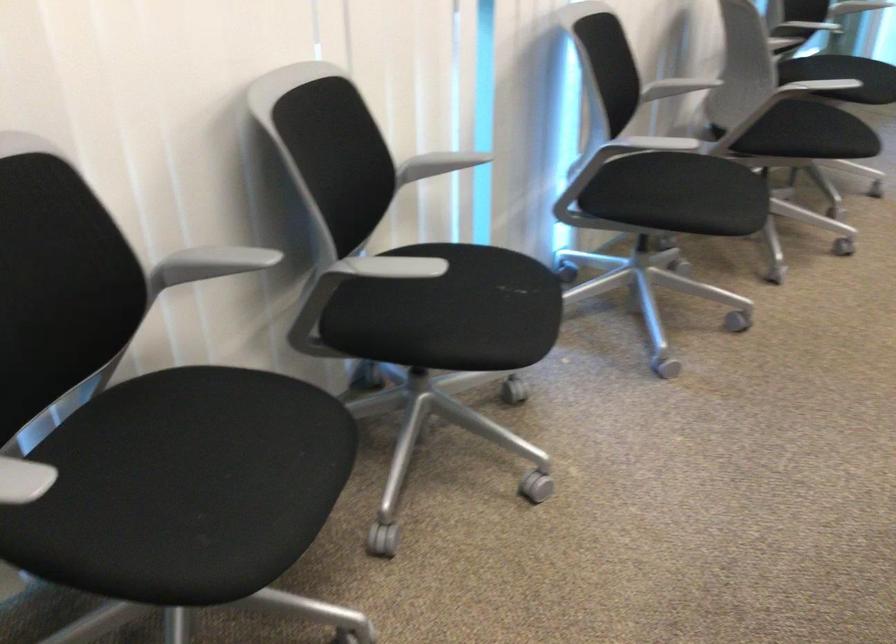
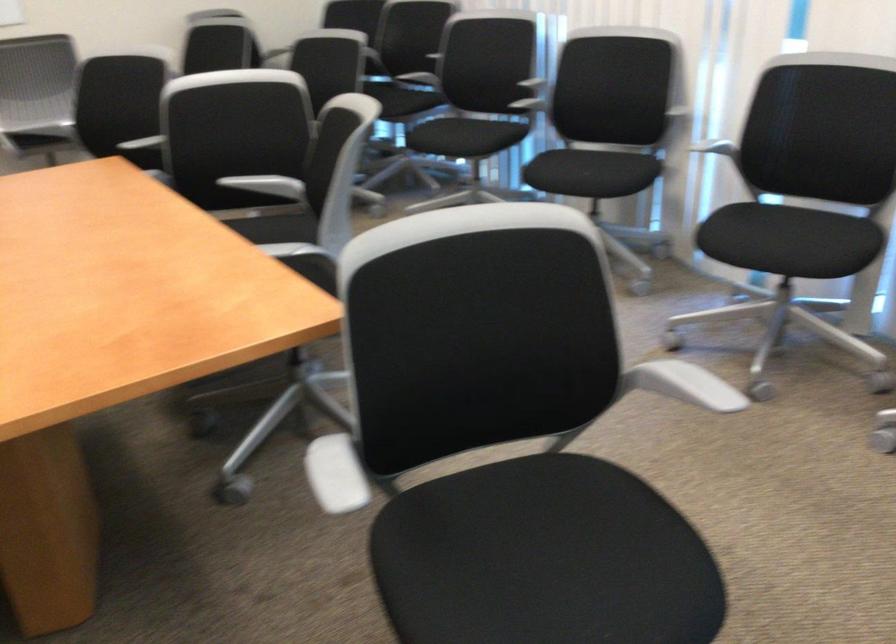
The point at (712, 172) is marked in the first image. Where is the corresponding point in the second image?

(789, 240)